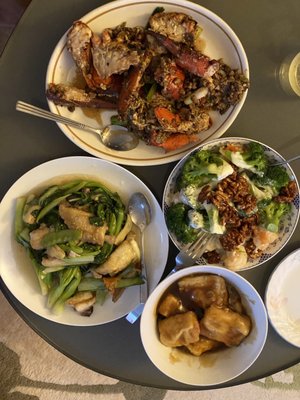
At what (x,y) coordinates should I click in order to perform the action: click on carpet. Please return your answer as a coordinate pair (x, y). This screenshot has height=400, width=300. Looking at the image, I should click on (278, 391).